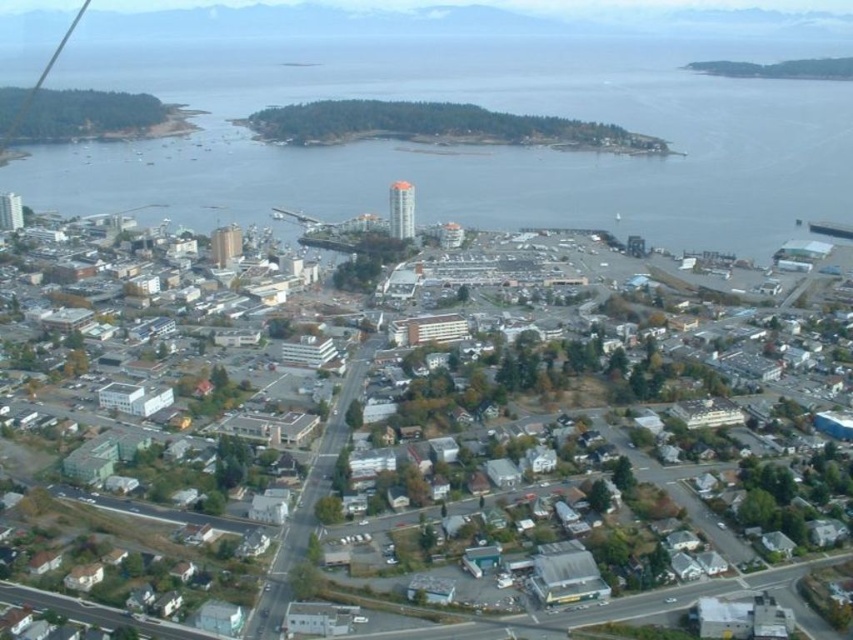
Is clear water at center below matte gray building at center?

Incorrect, clear water at center is not positioned below matte gray building at center.

Who is more forward, [100,211] or [119,477]?

Positioned in front is point [119,477].

Is point (741, 152) positioned after point (320, 387)?

Yes, point (741, 152) is farther from viewer.

You are a GUI agent. You are given a task and a screenshot of the screen. Output one action in this format:
    pyautogui.click(x=<x>, y=<y>)
    Task: Click on the clear water at center
    
    Given the screenshot: What is the action you would take?
    pyautogui.click(x=473, y=147)